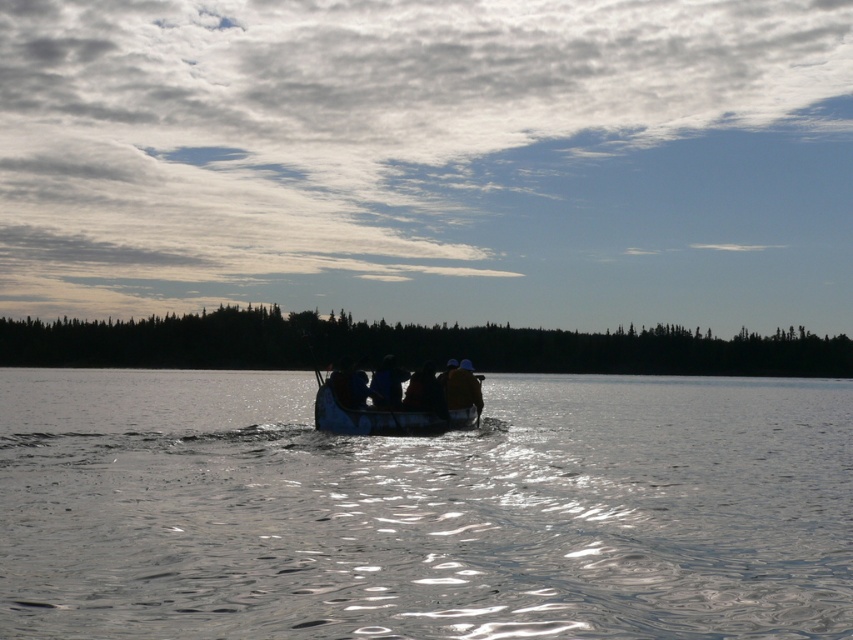
Which of these two, brown wooden canoe at center or blue fabric at center, stands taller?

brown wooden canoe at center

Can you confirm if brown wooden canoe at center is positioned to the right of blue fabric at center?

Correct, you'll find brown wooden canoe at center to the right of blue fabric at center.

Is point (381, 417) behind point (392, 369)?

No, it is in front of (392, 369).

The width and height of the screenshot is (853, 640). I want to click on brown wooden canoe at center, so click(x=384, y=419).

Which is below, clear water at center or blue fabric at center?

clear water at center

Who is more forward, (x=804, y=605) or (x=381, y=376)?

Point (x=804, y=605) is more forward.

Is point (303, 400) farther from camera compared to point (379, 374)?

Yes, it is behind point (379, 374).

Where is `clear water at center`? This screenshot has height=640, width=853. clear water at center is located at coordinates (422, 509).

Is the position of clear water at center more distant than that of brown wooden canoe at center?

That is False.

Does clear water at center have a lesser height compared to brown wooden canoe at center?

Incorrect, clear water at center's height does not fall short of brown wooden canoe at center's.

Locate an element on the screen. This screenshot has width=853, height=640. clear water at center is located at coordinates (422, 509).